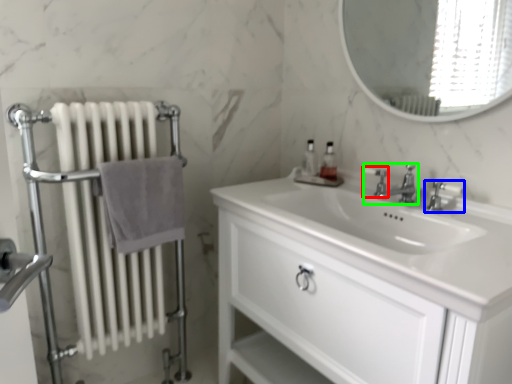
Question: Which object is positioned closest to plumbing fixture (highlighted by a red box)? Select from tap (highlighted by a blue box) and tap (highlighted by a green box).

Choices:
 (A) tap
 (B) tap

Answer: (B)